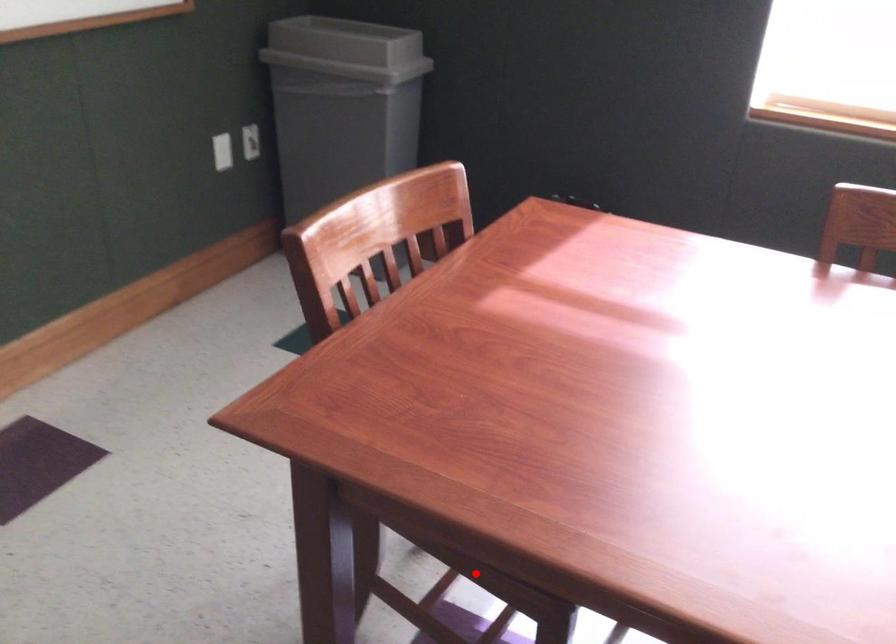
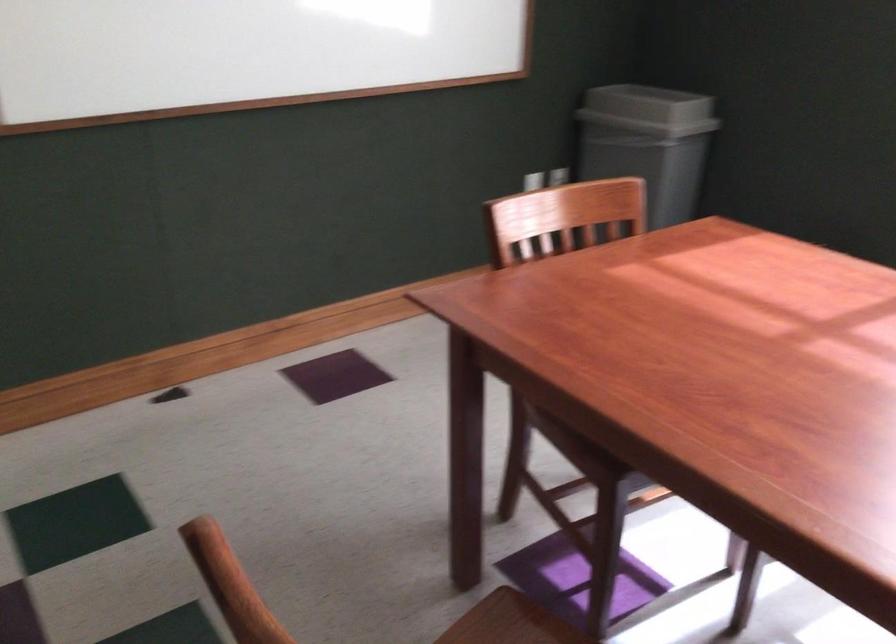
Question: I am providing you with two images of the same scene from different viewpoints. Given a red point in image1, look at the same physical point in image2. Is it:

Choices:
 (A) Closer to the viewpoint
 (B) Farther from the viewpoint

Answer: (B)